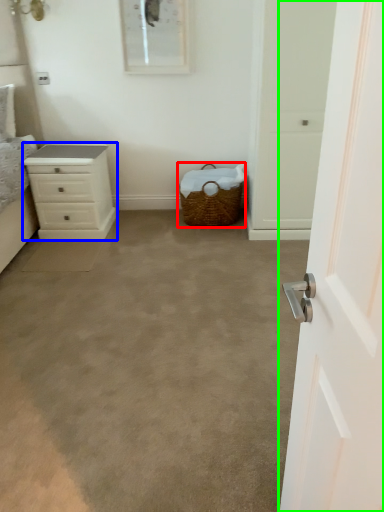
Question: Which object is positioned farthest from picnic basket (highlighted by a red box)? Select from chest of drawers (highlighted by a blue box) and door (highlighted by a green box).

Choices:
 (A) chest of drawers
 (B) door

Answer: (B)